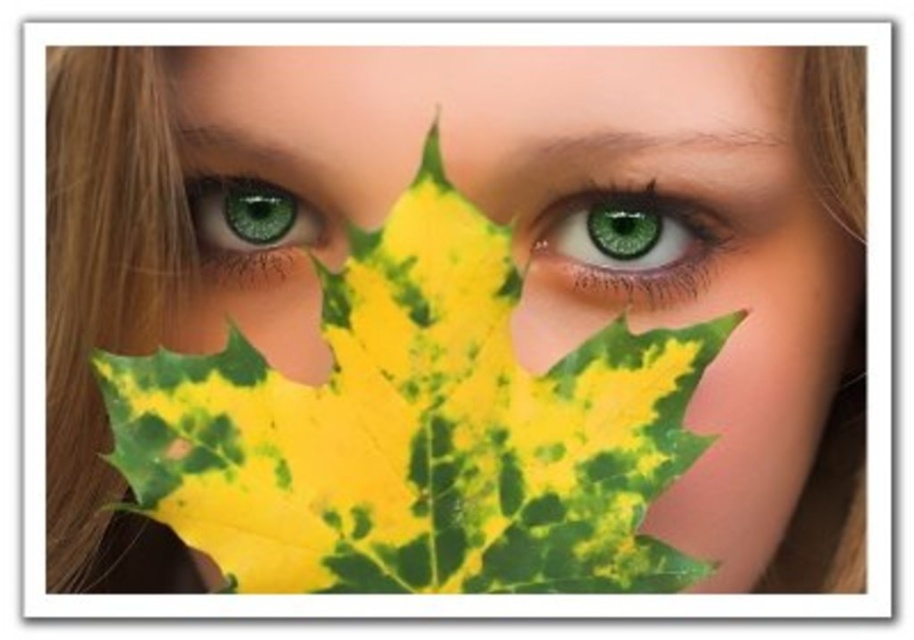
In the scene shown: Between green matte eye at center and green matte eye at upper left, which one appears on the right side from the viewer's perspective?

Positioned to the right is green matte eye at center.

Is point (646, 259) closer to camera compared to point (222, 225)?

Yes, it is in front of point (222, 225).

Is point (579, 195) farther from camera compared to point (319, 237)?

No, it is not.

The height and width of the screenshot is (640, 914). In order to click on green matte eye at center in this screenshot , I will do `click(623, 244)`.